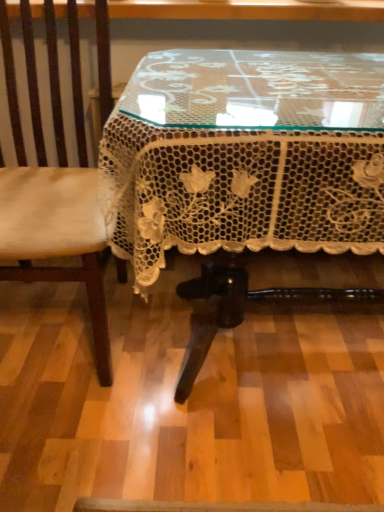
Question: Can you confirm if light brown leather chair at left is bigger than white lace tablecloth at center?

Choices:
 (A) no
 (B) yes

Answer: (A)

Question: Considering the relative sizes of light brown leather chair at left and white lace tablecloth at center in the image provided, is light brown leather chair at left shorter than white lace tablecloth at center?

Choices:
 (A) yes
 (B) no

Answer: (B)

Question: Considering the relative sizes of light brown leather chair at left and white lace tablecloth at center in the image provided, is light brown leather chair at left taller than white lace tablecloth at center?

Choices:
 (A) no
 (B) yes

Answer: (B)

Question: From a real-world perspective, is light brown leather chair at left under white lace tablecloth at center?

Choices:
 (A) yes
 (B) no

Answer: (B)

Question: Is white lace tablecloth at center inside light brown leather chair at left?

Choices:
 (A) no
 (B) yes

Answer: (A)

Question: Is light brown leather chair at left further to the viewer compared to white lace tablecloth at center?

Choices:
 (A) no
 (B) yes

Answer: (B)

Question: Considering the relative positions of white lace tablecloth at center and light brown leather chair at left in the image provided, is white lace tablecloth at center to the right of light brown leather chair at left from the viewer's perspective?

Choices:
 (A) yes
 (B) no

Answer: (A)

Question: Is the position of white lace tablecloth at center more distant than that of light brown leather chair at left?

Choices:
 (A) yes
 (B) no

Answer: (B)

Question: Is white lace tablecloth at center aimed at light brown leather chair at left?

Choices:
 (A) yes
 (B) no

Answer: (B)

Question: Does white lace tablecloth at center have a greater height compared to light brown leather chair at left?

Choices:
 (A) no
 (B) yes

Answer: (A)

Question: From the image's perspective, would you say white lace tablecloth at center is shown under light brown leather chair at left?

Choices:
 (A) yes
 (B) no

Answer: (A)

Question: Are white lace tablecloth at center and light brown leather chair at left located far from each other?

Choices:
 (A) no
 (B) yes

Answer: (A)

Question: In terms of height, does light brown leather chair at left look taller or shorter compared to white lace tablecloth at center?

Choices:
 (A) short
 (B) tall

Answer: (B)